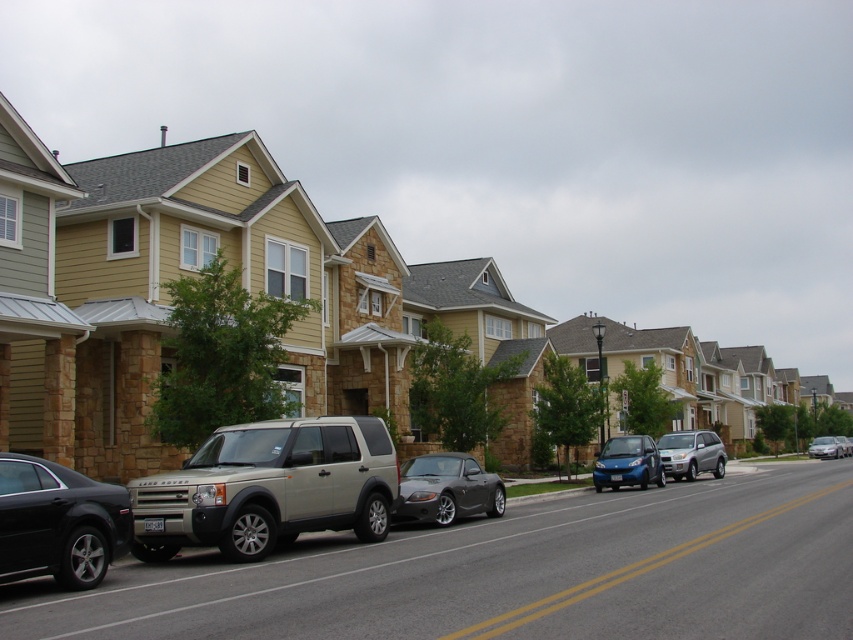
You are standing at the point marked by coordinates point (299, 476). You want to take a photo of the entire residential street. If your camera has a maximum zoom range of 10 meters, will you be able to capture the entire scene in one shot?

The distance between point (299, 476) and the camera is 11.90 meters. Since the camera can only zoom up to 10 meters, you will not be able to capture the entire scene in one shot.